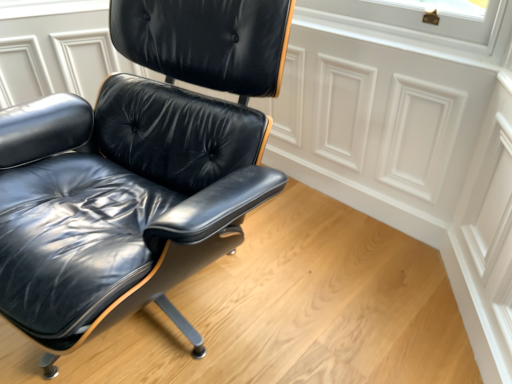
The width and height of the screenshot is (512, 384). What are the coordinates of `glossy black leather chair at lower left` in the screenshot? It's located at (138, 171).

Describe the element at coordinates (138, 171) in the screenshot. The width and height of the screenshot is (512, 384). I see `glossy black leather chair at lower left` at that location.

Where is `glossy black leather chair at lower left`? The height and width of the screenshot is (384, 512). glossy black leather chair at lower left is located at coordinates (138, 171).